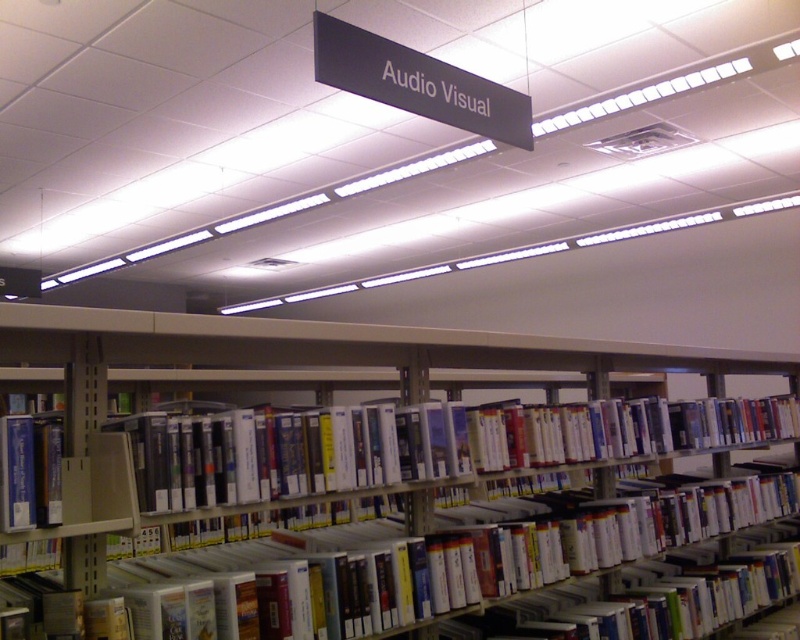
Question: Can you confirm if metallic gray bookcase at center is thinner than blue hardcover book at left?

Choices:
 (A) yes
 (B) no

Answer: (B)

Question: Is metallic gray bookcase at center positioned behind blue hardcover book at left?

Choices:
 (A) yes
 (B) no

Answer: (A)

Question: Can you confirm if metallic gray bookcase at center is thinner than blue hardcover book at left?

Choices:
 (A) no
 (B) yes

Answer: (A)

Question: Which of the following is the closest to the observer?

Choices:
 (A) (786, 426)
 (B) (20, 440)

Answer: (B)